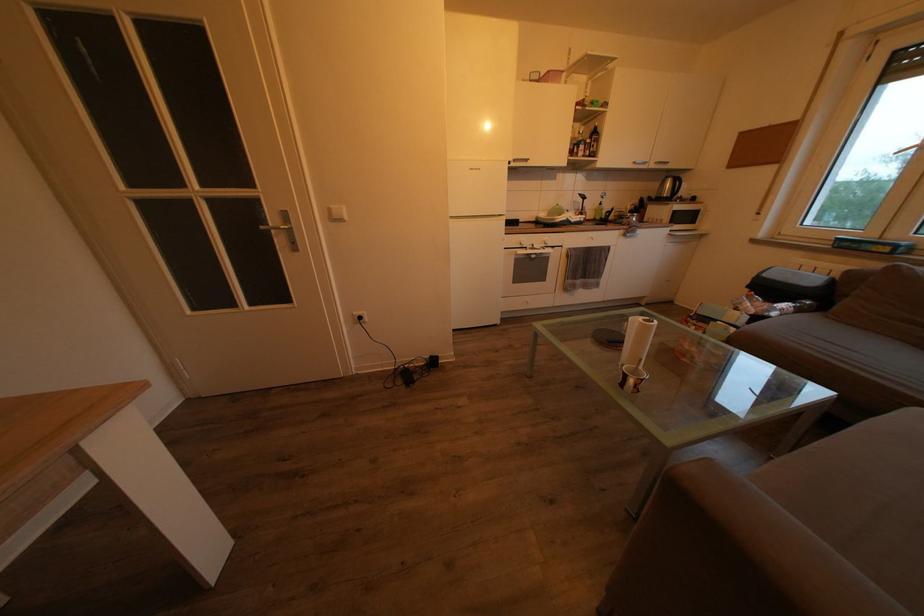
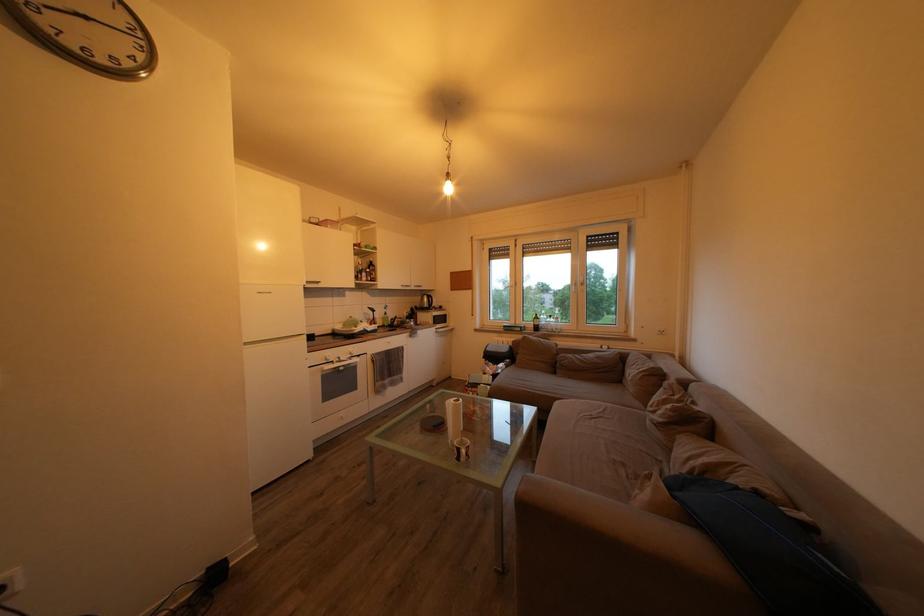
Find the pixel in the second image that matches [649,325] in the first image.

(459, 407)